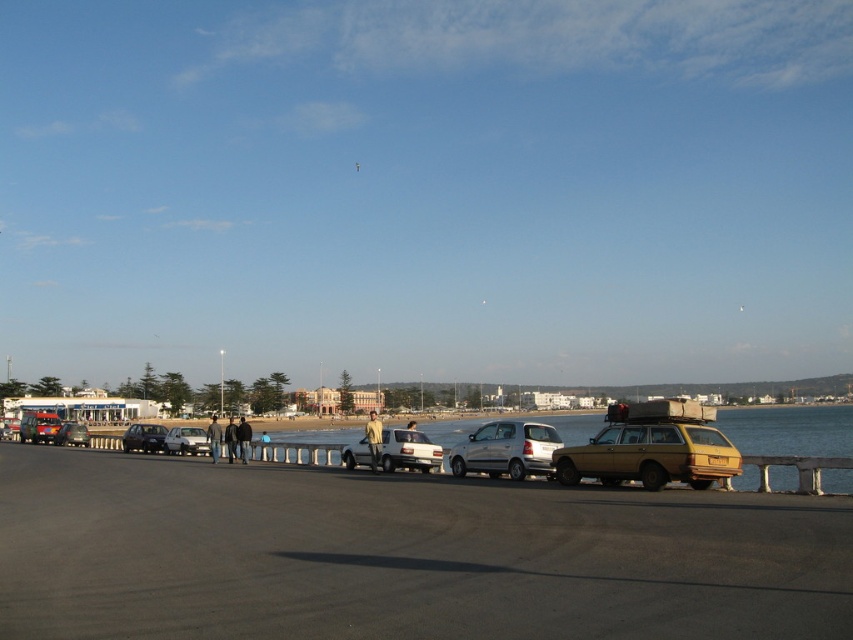
Question: Can you confirm if gold metallic station wagon at center is positioned above yellow matte license plate at center?

Choices:
 (A) no
 (B) yes

Answer: (A)

Question: Does satin silver hatchback at center have a larger size compared to matte silver sedan at center?

Choices:
 (A) no
 (B) yes

Answer: (A)

Question: Which is nearer to the matte silver sedan at center?

Choices:
 (A) matte black car at left
 (B) gold metallic station wagon at center
 (C) satin silver hatchback at center
 (D) matte silver suv at center

Answer: (D)

Question: Which point is closer to the camera taking this photo?

Choices:
 (A) (554, 467)
 (B) (537, 445)
 (C) (56, 442)
 (D) (183, 444)

Answer: (A)

Question: Which point is farther to the camera?

Choices:
 (A) (717, 461)
 (B) (88, 444)
 (C) (659, 468)

Answer: (B)

Question: Is the position of matte silver sedan at center less distant than that of yellow matte license plate at center?

Choices:
 (A) no
 (B) yes

Answer: (A)